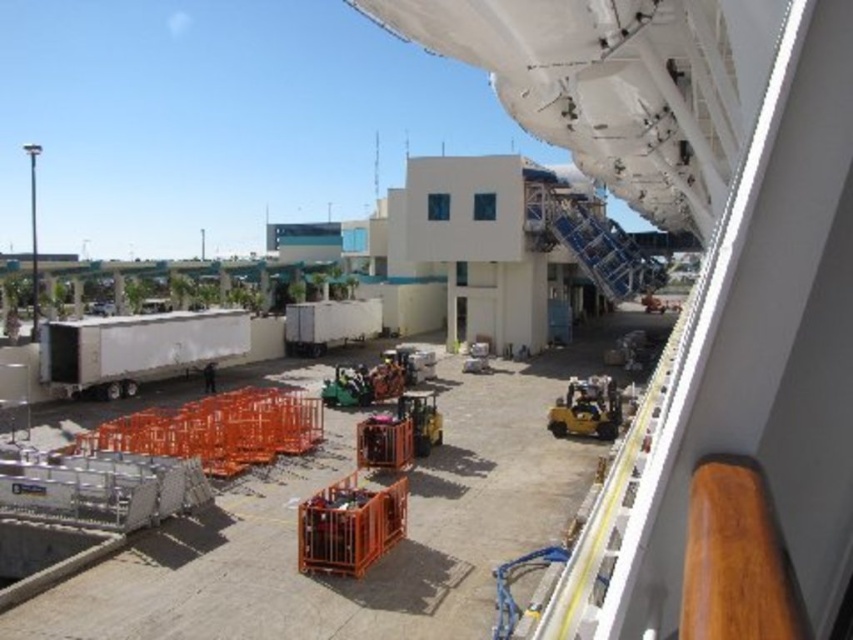
Is white matte trailer truck at center-left below white matte trailer truck at center?

Yes.

Does point (96, 376) lie in front of point (366, 323)?

Yes, it is.

Locate an element on the screen. white matte trailer truck at center-left is located at coordinates (136, 348).